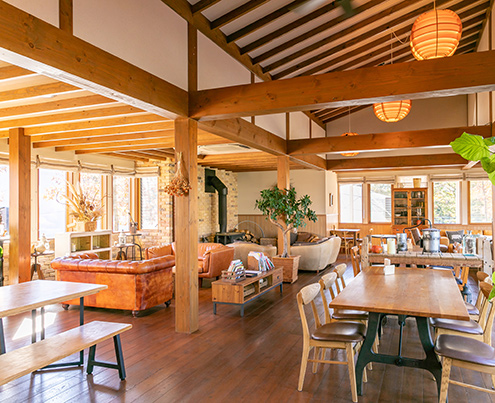
At what (x,y) coordinates should I click in order to perform the action: click on places to sit at the right table. Please return your answer as a coordinate pair (x, y). The width and height of the screenshot is (495, 403). Looking at the image, I should click on (312, 294), (334, 279), (343, 266), (475, 345), (474, 324), (472, 311).